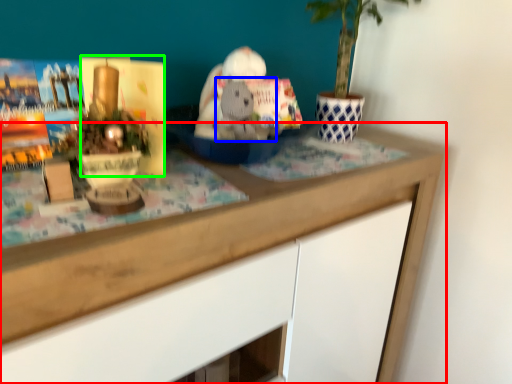
Question: Estimate the real-world distances between objects in this image. Which object is closer to desk (highlighted by a red box), animal (highlighted by a blue box) or paperback book (highlighted by a green box)?

Choices:
 (A) animal
 (B) paperback book

Answer: (A)